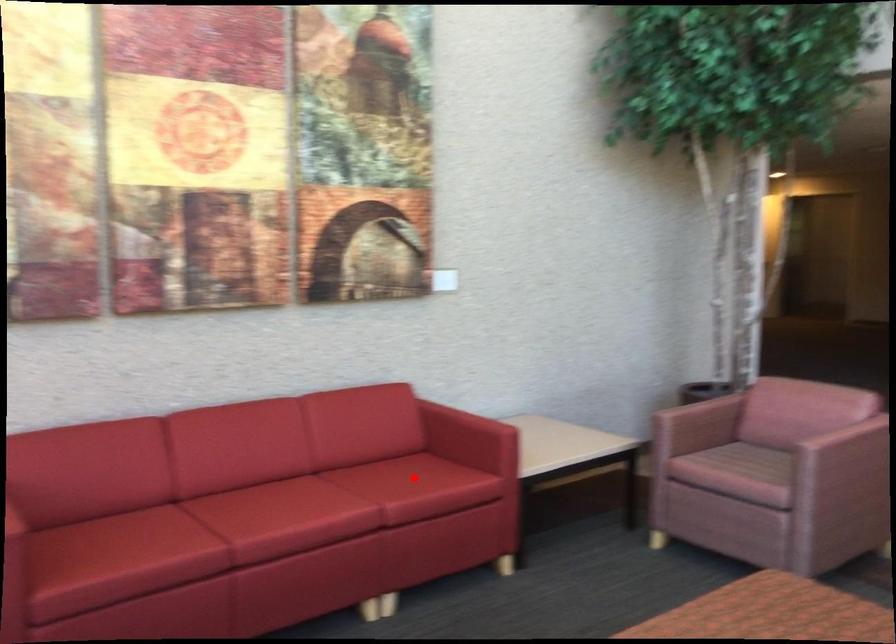
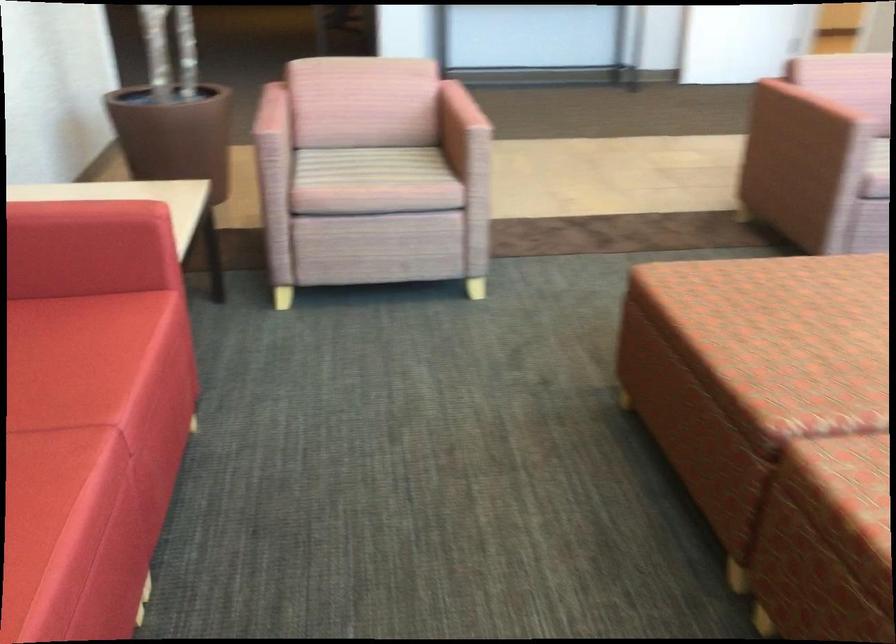
Find the pixel in the second image that matches the highlighted location in the first image.

(69, 360)